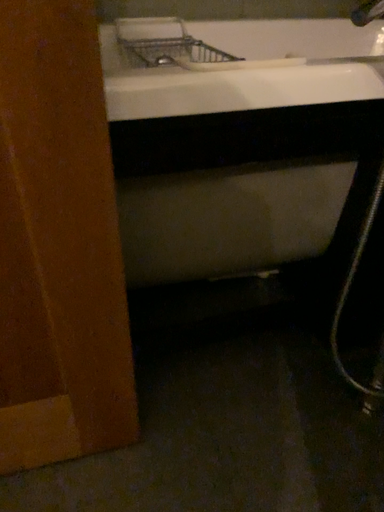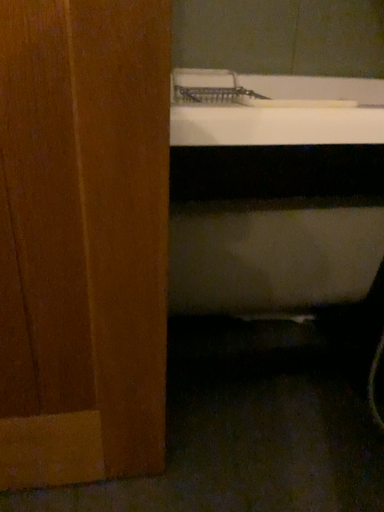
Question: Which way did the camera rotate in the video?

Choices:
 (A) rotated downward
 (B) rotated upward

Answer: (B)